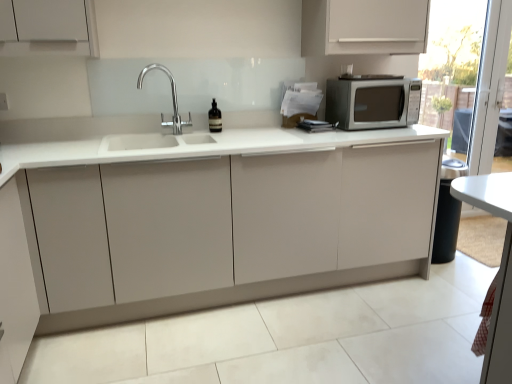
Locate an element on the screen. This screenshot has width=512, height=384. vacant area that is in front of brown glass bottle at center is located at coordinates (204, 132).